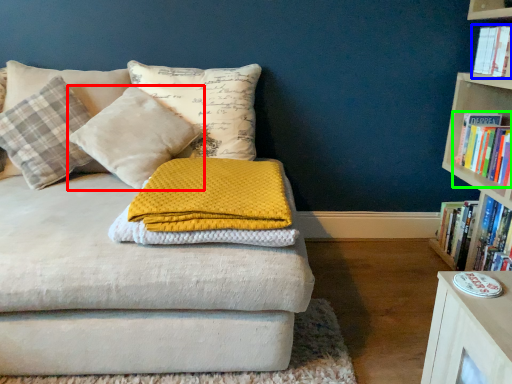
Question: Which object is the closest to the pillow (highlighted by a red box)? Choose among these: book (highlighted by a blue box) or book (highlighted by a green box).

Choices:
 (A) book
 (B) book

Answer: (B)